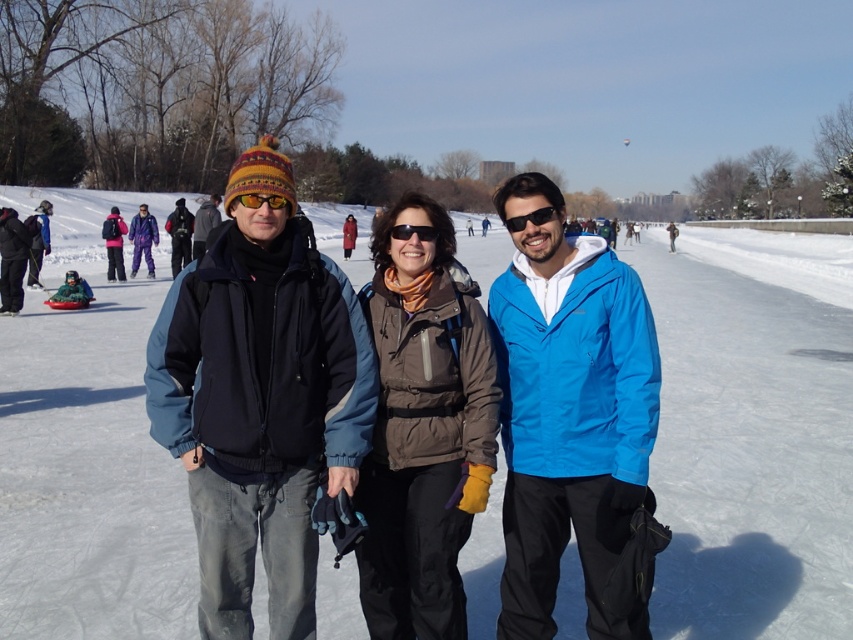
Question: Which of the following is the farthest from the observer?

Choices:
 (A) white snow at center
 (B) black puffy jacket at left

Answer: (B)

Question: Is matte blue jacket at center above black puffy jacket at left?

Choices:
 (A) no
 (B) yes

Answer: (A)

Question: Which point is closer to the camera taking this photo?

Choices:
 (A) pyautogui.click(x=13, y=230)
 (B) pyautogui.click(x=607, y=426)
 (C) pyautogui.click(x=140, y=241)
 (D) pyautogui.click(x=421, y=509)

Answer: (B)

Question: Does blue fabric jacket at center have a greater width compared to yellow reflective lens at center?

Choices:
 (A) yes
 (B) no

Answer: (A)

Question: Does matte blue jacket at center have a smaller size compared to matte black jacket at center?

Choices:
 (A) yes
 (B) no

Answer: (A)

Question: Which object is farther from the camera taking this photo?

Choices:
 (A) brown fuzzy vest at center
 (B) purple fleece jacket at center

Answer: (B)